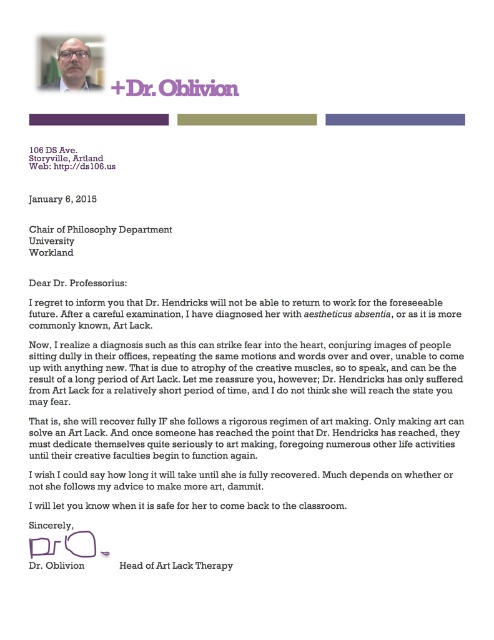
Question: Considering the relative positions of black paper at center and white paper at upper center in the image provided, where is black paper at center located with respect to white paper at upper center?

Choices:
 (A) above
 (B) below

Answer: (B)

Question: Which point is closer to the camera?

Choices:
 (A) white paper at upper center
 (B) black paper at center
 (C) matte black glasses at upper center

Answer: (C)

Question: Which object appears closest to the camera in this image?

Choices:
 (A) white paper at upper center
 (B) black paper at center

Answer: (A)

Question: Where is black paper at center located in relation to white paper at upper center in the image?

Choices:
 (A) right
 (B) left

Answer: (A)

Question: Which of the following is the farthest from the observer?

Choices:
 (A) black paper at center
 (B) white paper at upper center

Answer: (A)

Question: Is matte black glasses at upper center thinner than white paper at upper center?

Choices:
 (A) no
 (B) yes

Answer: (B)